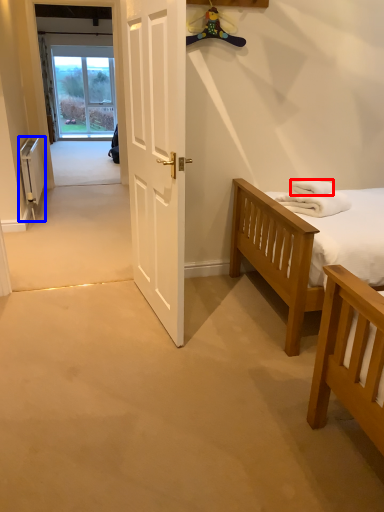
Question: Among these objects, which one is farthest to the camera, towel/napkin (highlighted by a red box) or radiator (highlighted by a blue box)?

Choices:
 (A) towel/napkin
 (B) radiator

Answer: (B)